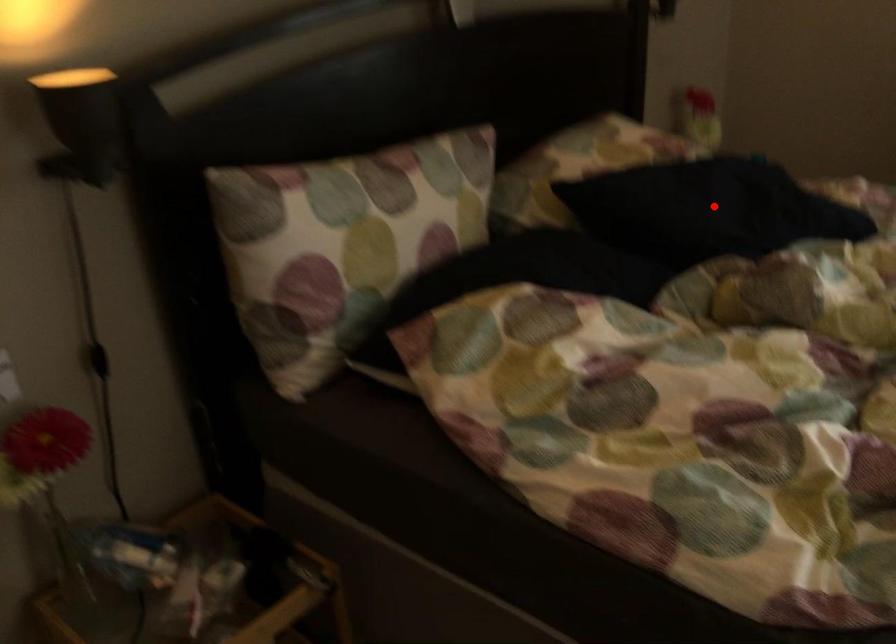
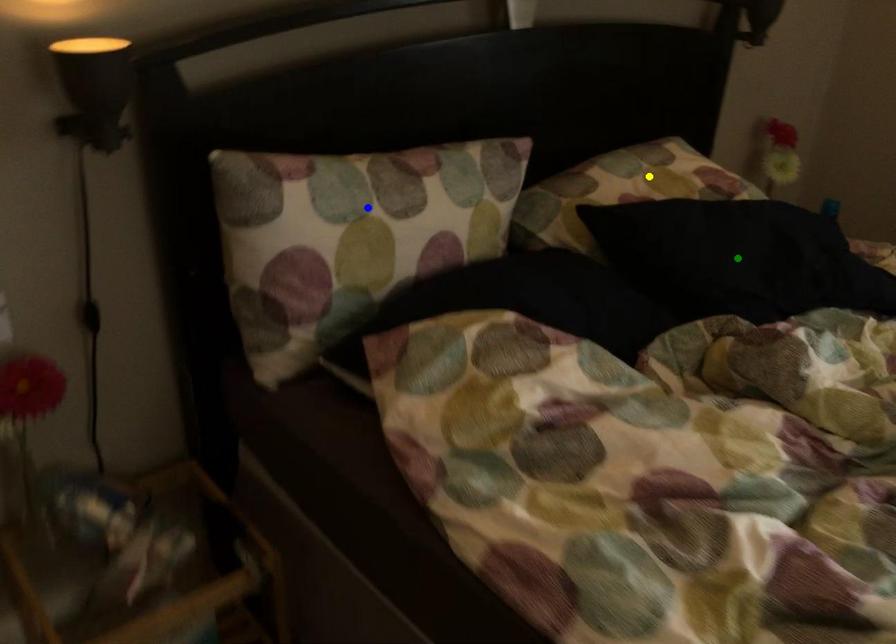
Question: I am providing you with two images of the same scene from different viewpoints. A red point is marked on the first image. You are given multiple points on the second image. Which point in image 2 is actually the same real-world point as the red point in image 1?

Choices:
 (A) yellow point
 (B) blue point
 (C) green point

Answer: (C)